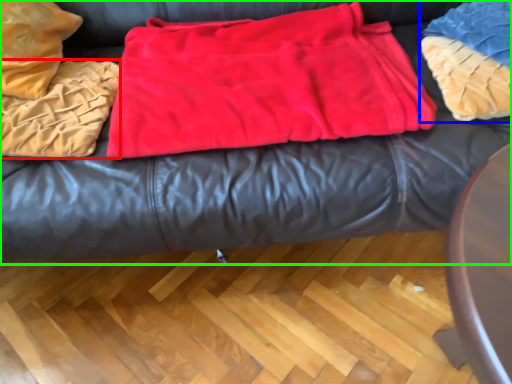
Question: Which object is positioned closest to blanket (highlighted by a red box)? Select from cloth (highlighted by a blue box) and furniture (highlighted by a green box).

Choices:
 (A) cloth
 (B) furniture

Answer: (B)